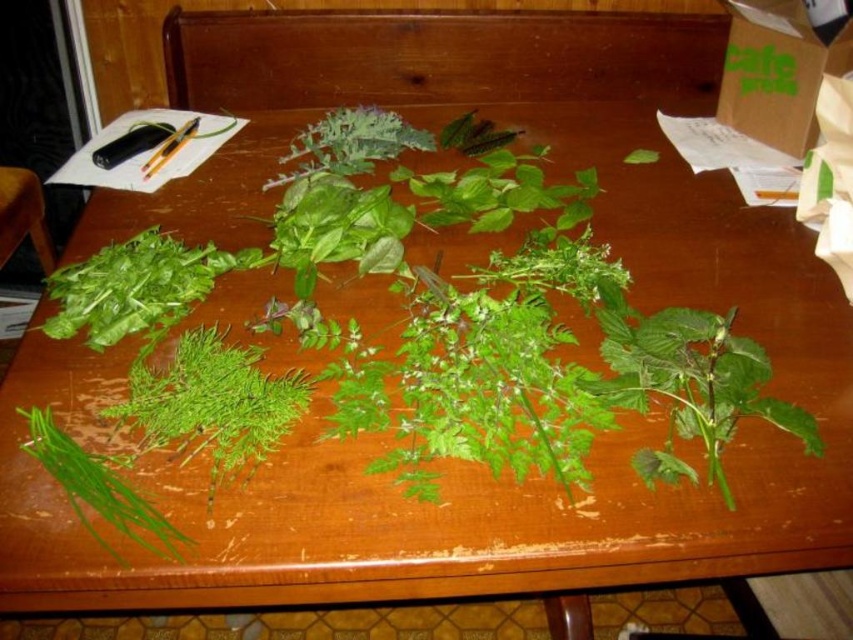
How much distance is there between green leafy at left and green leafy at lower left?

green leafy at left is 3.96 inches away from green leafy at lower left.

This screenshot has height=640, width=853. Identify the location of green leafy at left. (212, 401).

Find the location of `green leafy at left`. green leafy at left is located at coordinates (212, 401).

Identify the location of green leafy at left. This screenshot has height=640, width=853. click(x=212, y=401).